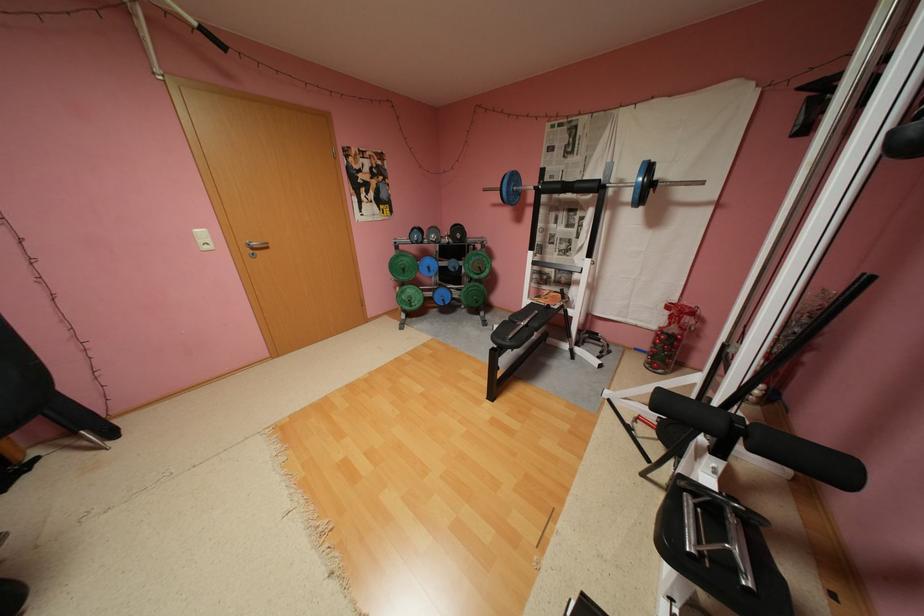
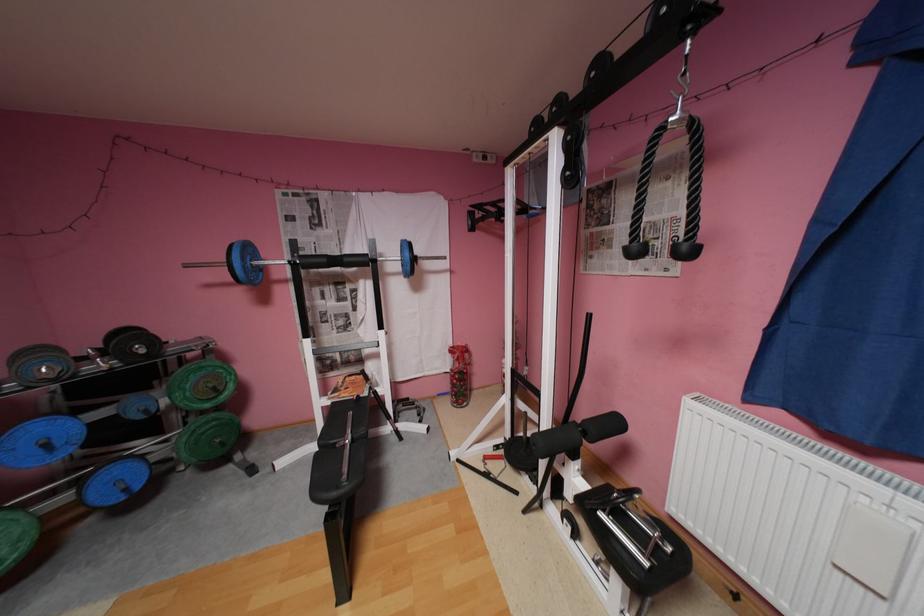
Find the pixel in the second image that matches the point at 489,267 in the first image.

(224, 387)